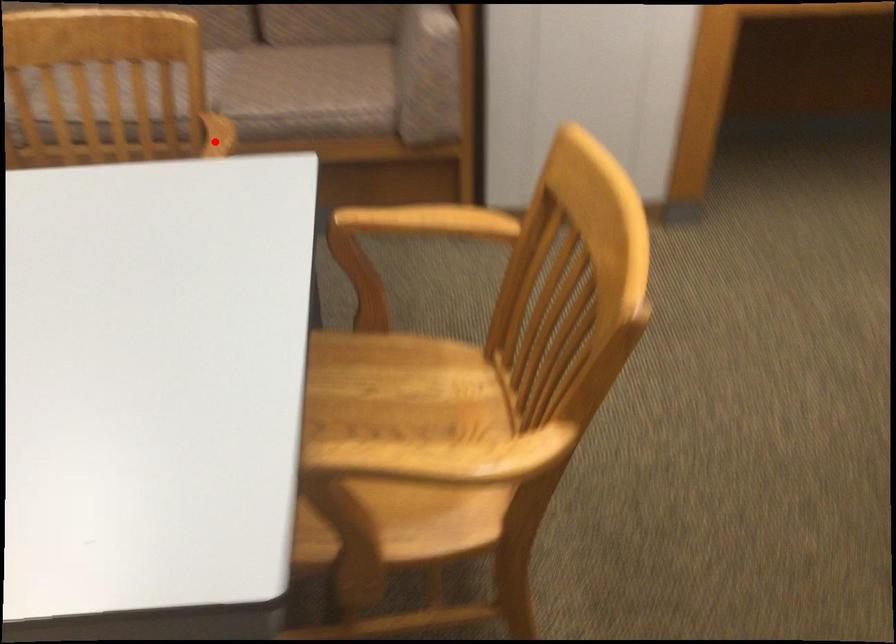
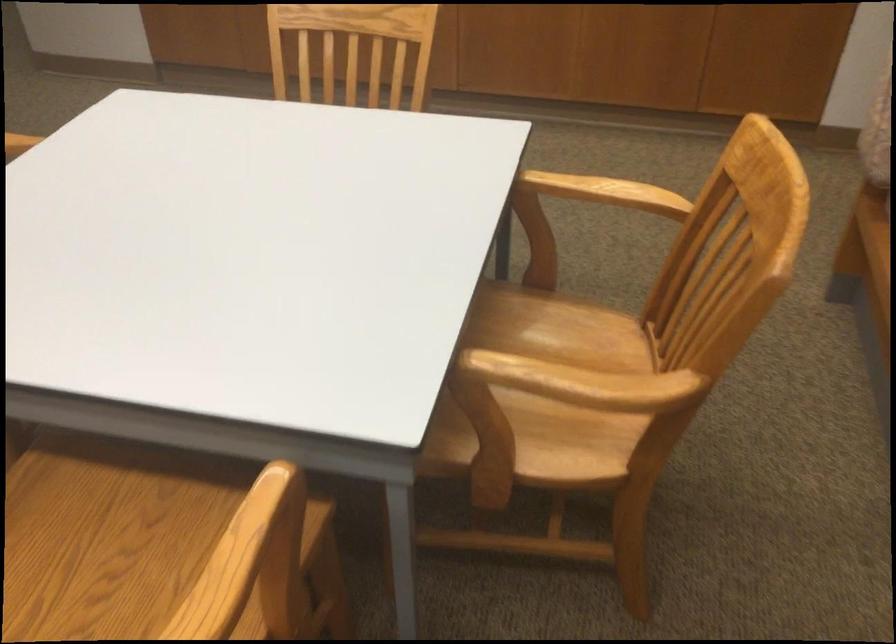
Where in the second image is the point corresponding to the highlighted location from the first image?

(583, 383)